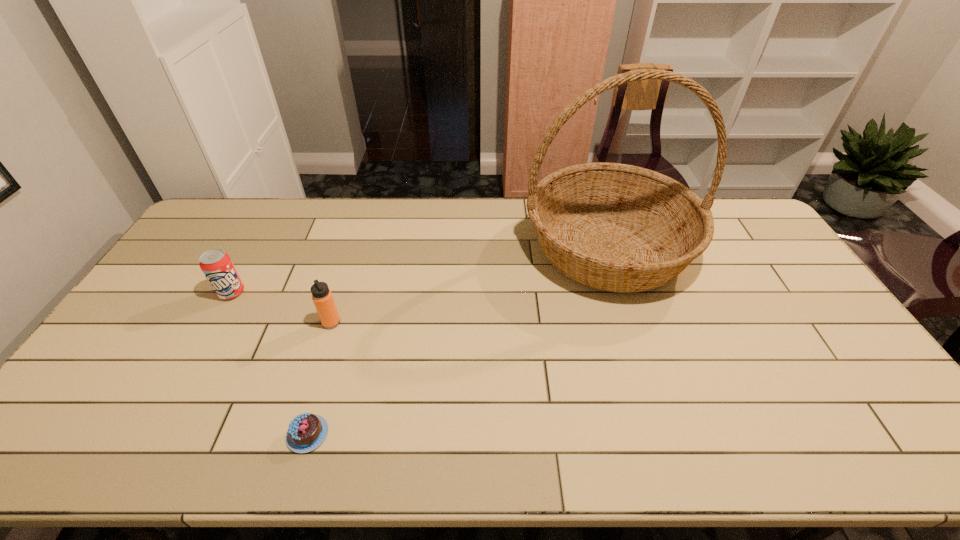
Find the location of a particular element. This screenshot has width=960, height=540. the rightmost object is located at coordinates (614, 227).

Find the location of `the tallest object`. the tallest object is located at coordinates (614, 227).

The image size is (960, 540). In order to click on thermos bottle in this screenshot , I will do `click(322, 297)`.

The width and height of the screenshot is (960, 540). Identify the location of soda can. (217, 266).

Locate an element on the screen. The image size is (960, 540). the nearest object is located at coordinates (306, 432).

Where is `the shortest object`? Image resolution: width=960 pixels, height=540 pixels. the shortest object is located at coordinates (306, 432).

Where is `free region located 0.370m on the front of the basket`? The height and width of the screenshot is (540, 960). free region located 0.370m on the front of the basket is located at coordinates (666, 426).

What are the coordinates of `free region located 0.180m on the right of the third farthest object` in the screenshot? It's located at (402, 322).

Find the location of a particular element. The width and height of the screenshot is (960, 540). vacant space positioned on the surface of the soda can is located at coordinates (207, 336).

Identify the location of free location located 0.170m on the left of the chocolate cake. (215, 434).